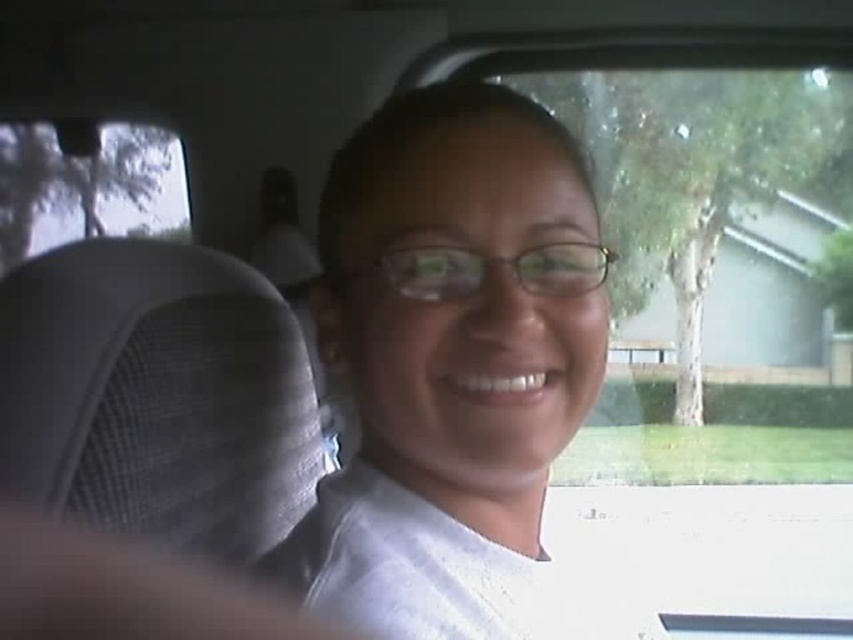
Consider the image. You are a passenger in a vehicle and want to reach the gray mesh headrest at left to adjust it. However, there is a white matte shirt at center in your way. Can you reach the headrest without moving the shirt?

The white matte shirt at center is further to the viewer than gray mesh headrest at left, so the shirt is closer to you. This means you cannot reach the headrest without moving the shirt because the shirt is blocking your access.

You are a passenger in the vehicle shown in the image. You notice two points marked on the window. The first point is at coordinates point (80, 547), and the second point is at coordinates point (119, 125). From your perspective inside the vehicle, which point is closer to you?

Point (80, 547) is in front of point (119, 125), so it is closer to you.

From the picture: You are a passenger in a vehicle and want to know which of the two points, point (x=390, y=476) or point (x=57, y=198), is closer to you. Based on the image, which point is nearer?

Point (x=390, y=476) is closer to the camera than point (x=57, y=198), so it is nearer to you.